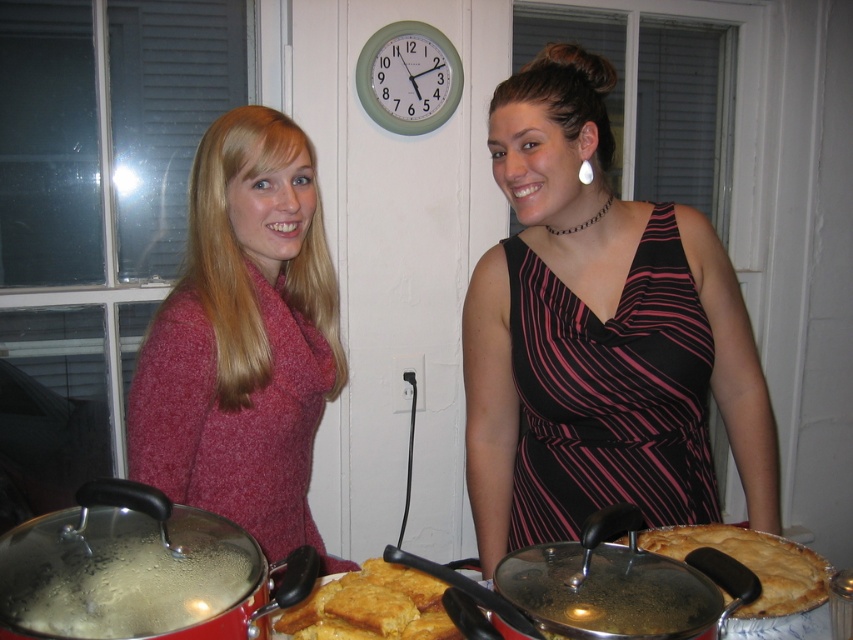
Looking at this image, you are a chef who needs to place a golden brown crusty bread at center on the kitchen counter. The counter is represented by the point at coordinates (372, 605). Can you confirm if the golden brown crusty bread at center is already placed correctly on the counter?

The golden brown crusty bread at center is located at point (372, 605), so yes, it is correctly placed on the counter.

You are planning to take a photo of the golden flaky pie at center right and the matte red sweater at center. Since you want to ensure both are in focus, you need to know their relative sizes. Which object is larger?

The matte red sweater at center is bigger than the golden flaky pie at center right, so you should adjust your camera settings to accommodate the size difference for proper focus.

You are standing in the kitchen and want to place a new decorative item on the counter. The golden brown crusty bread at center is currently occupying the space at point 0.947, 0.437. Where should you place the new item to avoid overlapping with the bread?

The golden brown crusty bread at center is located at point (372, 605). To avoid overlapping, place the new item at a different coordinate on the counter, such as point (426, 320) or point (254, 128).